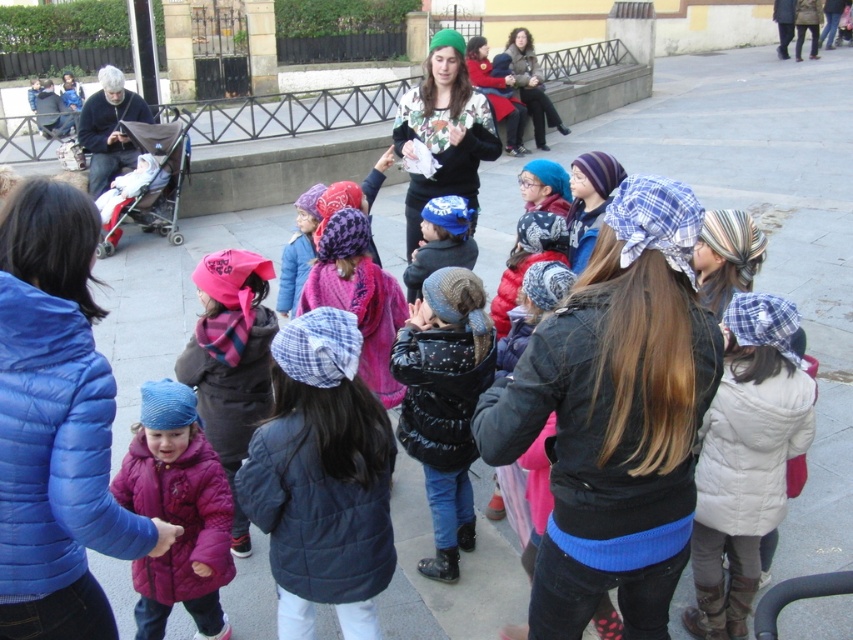
Question: From the image, what is the correct spatial relationship of white puffy coat at center in relation to matte pink coat at center?

Choices:
 (A) above
 (B) below

Answer: (A)

Question: Is black puffy jacket at center further to camera compared to matte black jacket at left?

Choices:
 (A) no
 (B) yes

Answer: (A)

Question: Estimate the real-world distances between objects in this image. Which object is farther from the white puffy coat at center?

Choices:
 (A) matte pink coat at center
 (B) black puffy jacket at center

Answer: (A)

Question: Which object appears closest to the camera in this image?

Choices:
 (A) matte pink coat at center
 (B) black puffy jacket at center

Answer: (A)

Question: Does black puffy jacket at center come behind matte black jacket at left?

Choices:
 (A) yes
 (B) no

Answer: (B)

Question: Estimate the real-world distances between objects in this image. Which object is farther from the black puffy jacket at center?

Choices:
 (A) white puffy coat at center
 (B) matte pink coat at center
 (C) matte black jacket at left

Answer: (C)